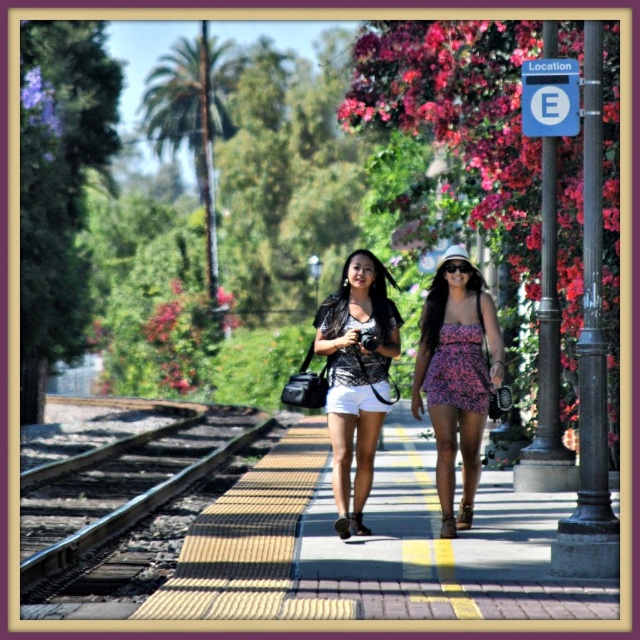
Does point (472, 321) come in front of point (593, 323)?

No, (472, 321) is further to viewer.

Is point (468, 403) positioned before point (586, 340)?

No, it is behind (586, 340).

Find the location of `floral-patterned dress at center`. floral-patterned dress at center is located at coordinates (456, 376).

Is dark brown wooden train track at lower left wider than floral dress at center?

Result: Yes.

Consider the image. How distant is dark brown wooden train track at lower left from floral dress at center?

The distance of dark brown wooden train track at lower left from floral dress at center is 6.30 meters.

Is point (115, 608) positioned in front of point (445, 298)?

That is True.

The width and height of the screenshot is (640, 640). In order to click on dark brown wooden train track at lower left in this screenshot , I will do click(131, 513).

Does floral-patterned dress at center appear on the left side of matte black camera at center?

In fact, floral-patterned dress at center is to the right of matte black camera at center.

In the scene shown: Between floral-patterned dress at center and matte black camera at center, which one has less height?

Standing shorter between the two is matte black camera at center.

Is point (420, 400) farther from viewer compared to point (330, 333)?

That is True.

Where is `floral-patterned dress at center`? floral-patterned dress at center is located at coordinates (456, 376).